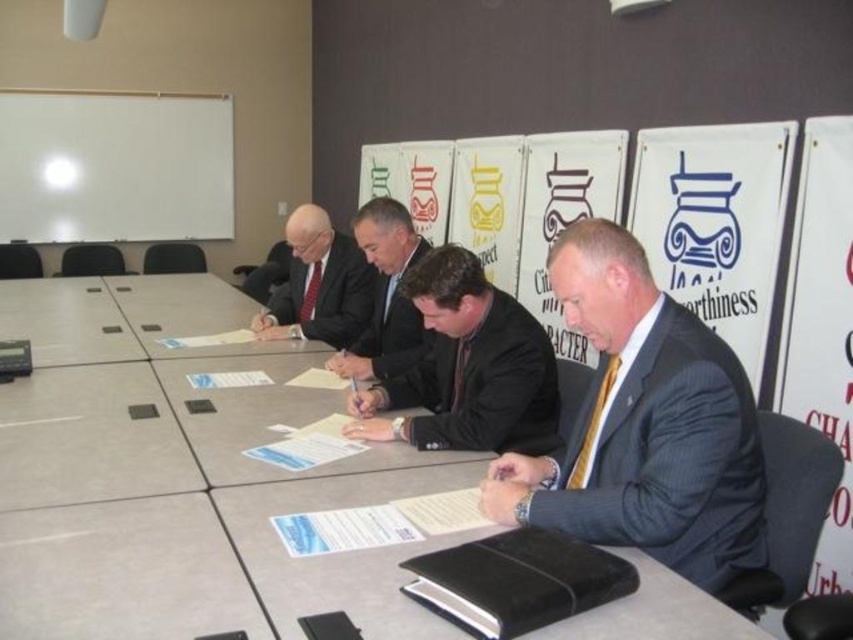
Question: Which is farther from the white matte board at upper left?

Choices:
 (A) dark blue suit at center
 (B) matte black suit at center

Answer: (A)

Question: Does dark suit at center appear on the right side of light gray laminate table at center?

Choices:
 (A) no
 (B) yes

Answer: (B)

Question: Which of the following is the farthest from the observer?

Choices:
 (A) (351, 371)
 (B) (497, 422)

Answer: (A)

Question: Which is farther from the dark suit at center?

Choices:
 (A) matte black suit at center
 (B) smooth gray table at center
 (C) white matte board at upper left

Answer: (C)

Question: Is white matte board at upper left thinner than light gray laminate table at center?

Choices:
 (A) yes
 (B) no

Answer: (A)

Question: In this image, where is dark suit at center located relative to matte black suit at center?

Choices:
 (A) below
 (B) above

Answer: (A)